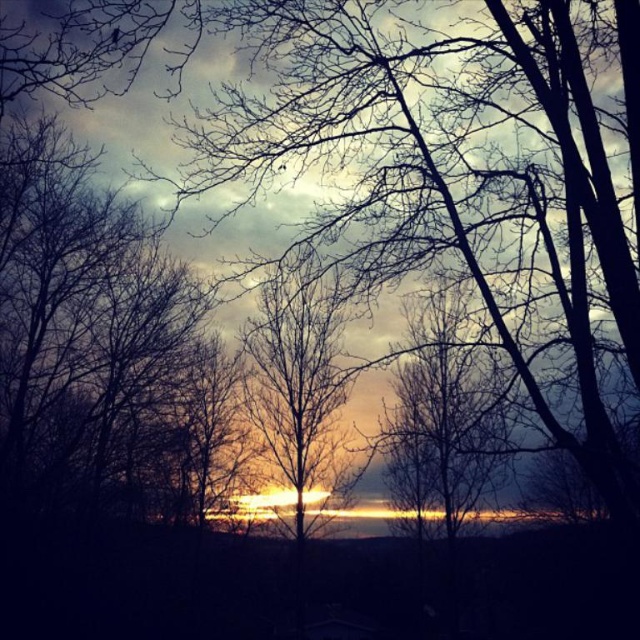
Question: Which object appears farthest from the camera in this image?

Choices:
 (A) silhouetted bare tree at center
 (B) silhouette bare tree at center

Answer: (A)

Question: Does silhouette bare tree at center have a lesser width compared to silhouetted bare tree at center?

Choices:
 (A) yes
 (B) no

Answer: (A)

Question: Is silhouette bare tree at center bigger than silhouetted bare tree at center?

Choices:
 (A) no
 (B) yes

Answer: (A)

Question: Is silhouette bare tree at center bigger than silhouetted bare tree at center?

Choices:
 (A) no
 (B) yes

Answer: (A)

Question: Which of the following is the farthest from the observer?

Choices:
 (A) silhouette bare tree at center
 (B) silhouetted bare tree at center

Answer: (B)

Question: Which object appears farthest from the camera in this image?

Choices:
 (A) silhouette bare tree at center
 (B) silhouetted bare tree at center

Answer: (B)